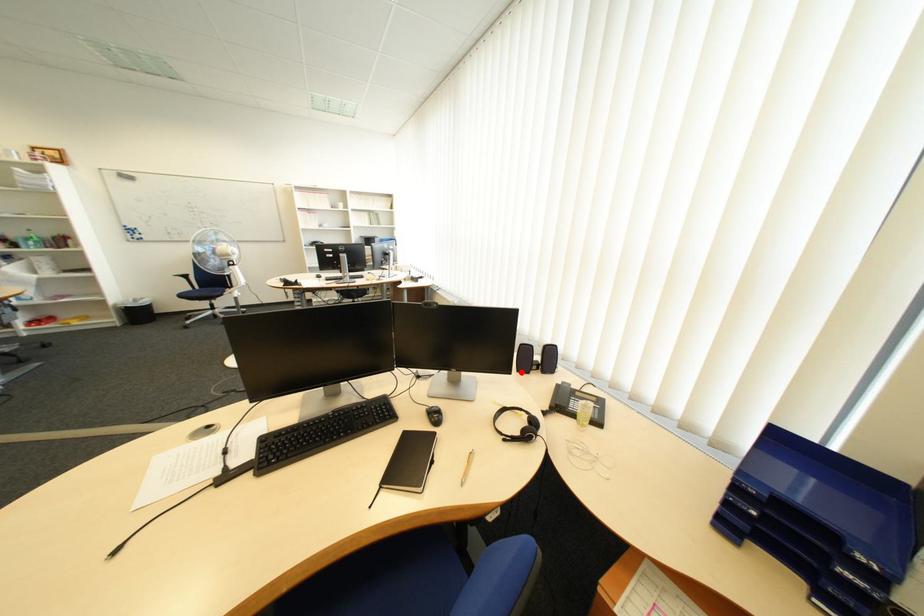
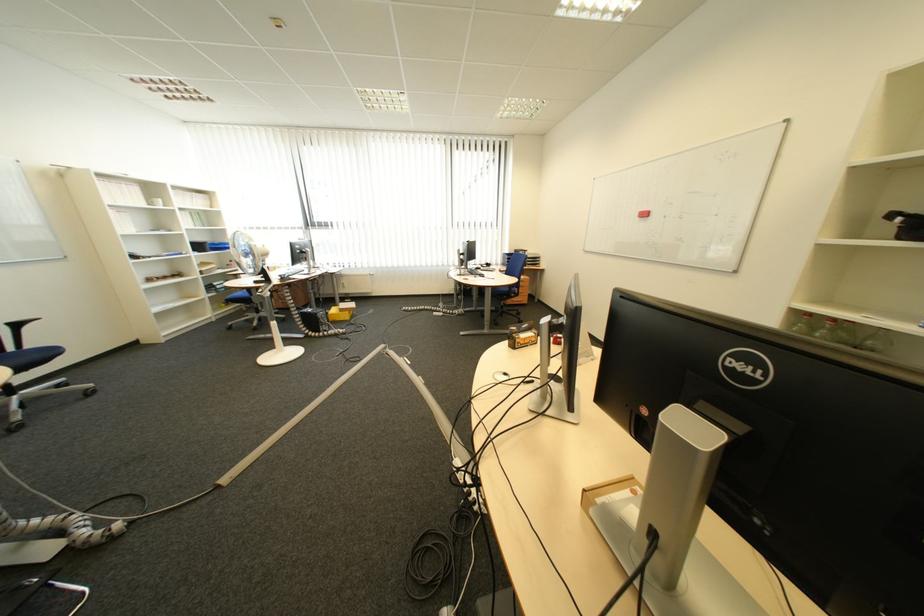
Question: I am providing you with two images of the same scene from different viewpoints. A red point is marked on the first image. Can you still see the location of the red point in image 2?

Choices:
 (A) Yes
 (B) No

Answer: (B)